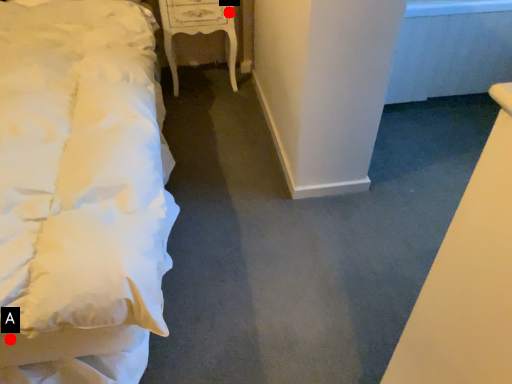
Question: Two points are circled on the image, labeled by A and B beside each circle. Which point is farther to the camera?

Choices:
 (A) A is further
 (B) B is further

Answer: (B)